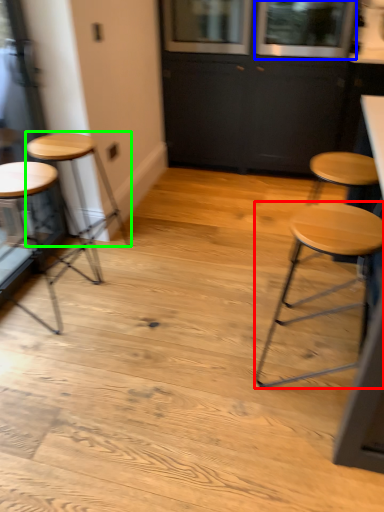
Question: Estimate the real-world distances between objects in this image. Which object is closer to stool (highlighted by a red box), window (highlighted by a blue box) or stool (highlighted by a green box)?

Choices:
 (A) window
 (B) stool

Answer: (B)